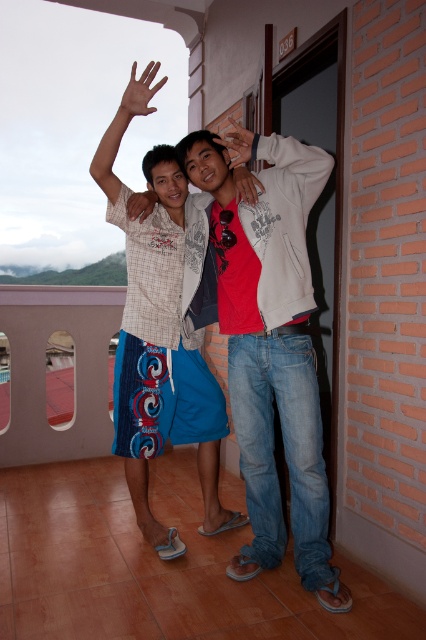
Can you confirm if brown matte hand at upper left is shorter than matte brown hand at center?

No, brown matte hand at upper left is not shorter than matte brown hand at center.

Is brown matte hand at upper left further to camera compared to matte brown hand at center?

No, it is not.

At what (x,y) coordinates should I click in order to perform the action: click on brown matte hand at upper left. Please return your answer as a coordinate pair (x, y). Looking at the image, I should click on (140, 92).

Image resolution: width=426 pixels, height=640 pixels. Identify the location of brown matte hand at upper left. (140, 92).

Can you confirm if white matte jacket at upper center is bigger than matte brown hand at center?

Yes, white matte jacket at upper center is bigger than matte brown hand at center.

Can you confirm if white matte jacket at upper center is positioned above matte brown hand at center?

Yes.

Locate an element on the screen. The height and width of the screenshot is (640, 426). white matte jacket at upper center is located at coordinates (282, 157).

Between white matte jacket at upper center and matte black hand at upper center, which one has less height?

matte black hand at upper center

Is point (262, 177) less distant than point (221, 145)?

Yes.

Who is more forward, (304, 196) or (241, 141)?

Point (241, 141)

Locate an element on the screen. The image size is (426, 640). white matte jacket at upper center is located at coordinates (282, 157).